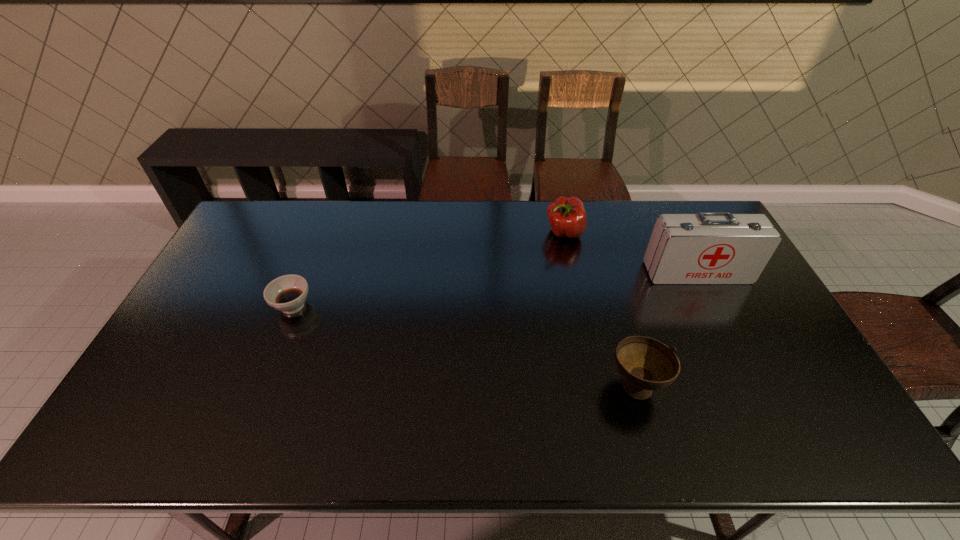
Identify the location of unoccupied area between the pepper and the farther soup bowl. The width and height of the screenshot is (960, 540). (428, 269).

Identify the location of vacant space in between the taller soup bowl and the farthest object. This screenshot has width=960, height=540. (600, 309).

Identify the location of free point between the pepper and the right soup bowl. The image size is (960, 540). (600, 309).

At what (x,y) coordinates should I click in order to perform the action: click on vacant space that's between the first-aid kit and the pepper. Please return your answer as a coordinate pair (x, y). The height and width of the screenshot is (540, 960). Looking at the image, I should click on (631, 253).

Identify the location of unoccupied position between the rightmost object and the farthest object. Image resolution: width=960 pixels, height=540 pixels. (631, 253).

Identify the location of free space between the nearest object and the pepper. (600, 309).

I want to click on vacant point located between the third nearest object and the farthest object, so click(631, 253).

The width and height of the screenshot is (960, 540). Identify the location of object identified as the third closest to the right soup bowl. (287, 293).

Choose which object is the second nearest neighbor to the right soup bowl. Please provide its 2D coordinates. Your answer should be formatted as a tuple, i.e. [(x, y)], where the tuple contains the x and y coordinates of a point satisfying the conditions above.

[(567, 216)]